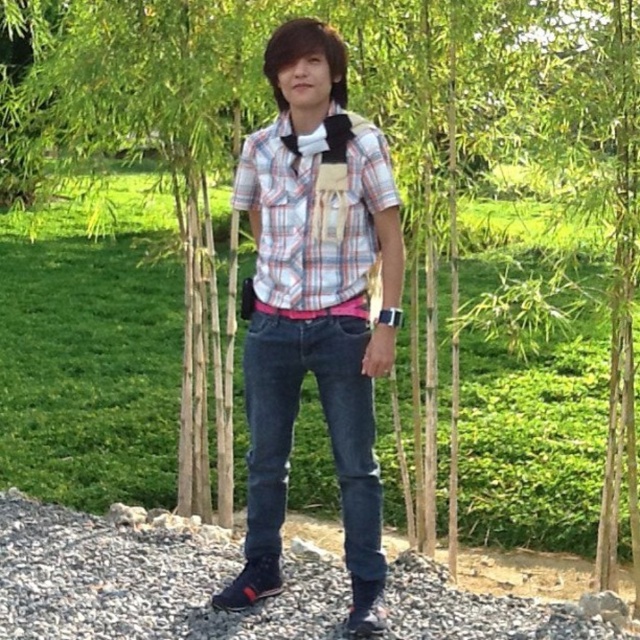
You are a fashion designer analyzing the outfit of the person in the image. The person is wearing a plaid cotton shirt at center and a plaid shirt at center. Which one is positioned lower on the body?

The plaid cotton shirt at center is below plaid shirt at center, so it is positioned lower on the body.